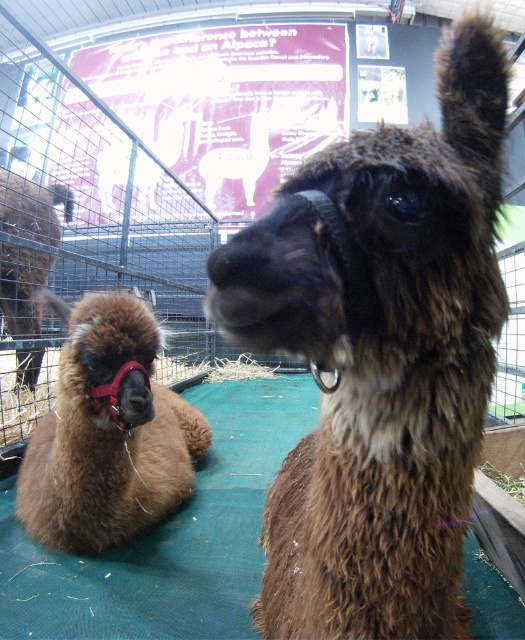
Is brown fuzzy alpaca at center above brown fuzzy camel at left?

No.

Can you confirm if brown fuzzy alpaca at center is shorter than brown fuzzy camel at left?

Yes.

Who is more forward, (336, 422) or (55, 212)?

Positioned in front is point (336, 422).

I want to click on brown fuzzy alpaca at center, so click(382, 358).

How distant is brown fuzzy alpaca at center from brown fuzzy alpaca at left?

brown fuzzy alpaca at center is 21.51 inches away from brown fuzzy alpaca at left.

Between brown fuzzy alpaca at center and brown fuzzy alpaca at left, which one appears on the left side from the viewer's perspective?

Positioned to the left is brown fuzzy alpaca at left.

At what (x,y) coordinates should I click in order to perform the action: click on brown fuzzy alpaca at center. Please return your answer as a coordinate pair (x, y). The height and width of the screenshot is (640, 525). Looking at the image, I should click on (382, 358).

Between brown fuzzy alpaca at left and brown fuzzy camel at left, which one appears on the left side from the viewer's perspective?

brown fuzzy camel at left

Can you confirm if brown fuzzy alpaca at left is taller than brown fuzzy camel at left?

No.

The height and width of the screenshot is (640, 525). What do you see at coordinates (108, 435) in the screenshot? I see `brown fuzzy alpaca at left` at bounding box center [108, 435].

What are the coordinates of `brown fuzzy alpaca at left` in the screenshot? It's located at (108, 435).